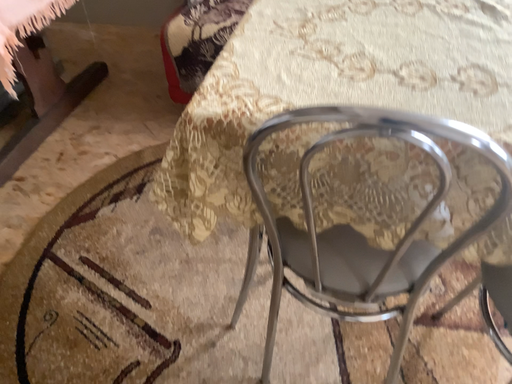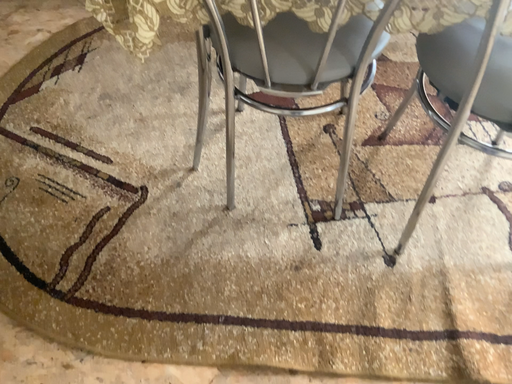
Question: How did the camera likely rotate when shooting the video?

Choices:
 (A) rotated upward
 (B) rotated downward

Answer: (B)